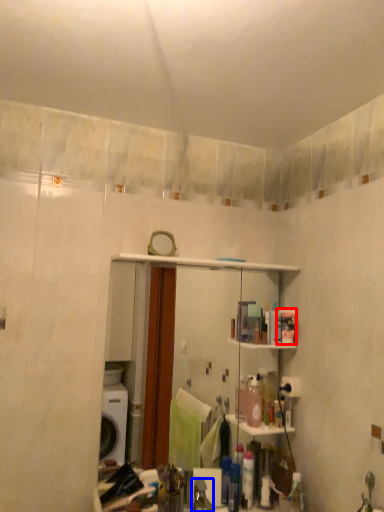
Question: Which object is further to the camera taking this photo, toiletry (highlighted by a red box) or faucet (highlighted by a blue box)?

Choices:
 (A) toiletry
 (B) faucet

Answer: (A)